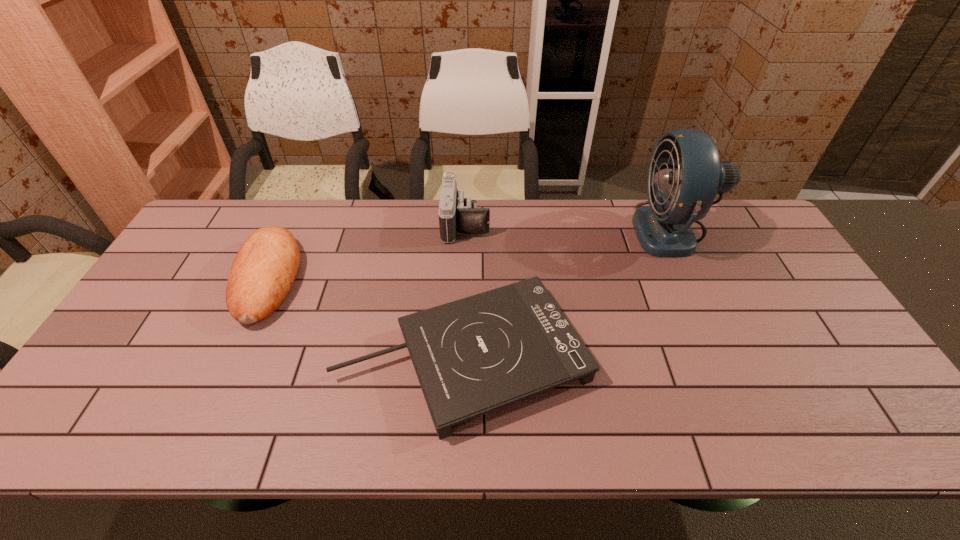
Where is `blank region between the third shortest object and the fan`? Image resolution: width=960 pixels, height=540 pixels. blank region between the third shortest object and the fan is located at coordinates (568, 227).

This screenshot has height=540, width=960. Find the location of `vacant space that's between the bread and the second tallest object`. vacant space that's between the bread and the second tallest object is located at coordinates (367, 252).

The height and width of the screenshot is (540, 960). I want to click on object that stands as the third closest to the fan, so click(x=264, y=269).

I want to click on object that ranks as the third closest to the bread, so click(x=678, y=196).

The image size is (960, 540). What are the coordinates of `vacant space that satisfies the following two spatial constraints: 1. at the front of the camera with an open lens cover; 2. on the left side of the shortest object` in the screenshot? It's located at (461, 356).

Identify the location of free region that satisfies the following two spatial constraints: 1. at the front of the camera with an open lens cover; 2. on the right side of the hotplate. The height and width of the screenshot is (540, 960). (461, 356).

The height and width of the screenshot is (540, 960). I want to click on blank space that satisfies the following two spatial constraints: 1. at the front of the second tallest object with an open lens cover; 2. on the back side of the hotplate, so click(x=461, y=356).

At what (x,y) coordinates should I click in order to perform the action: click on vacant region that satisfies the following two spatial constraints: 1. at the front of the hotplate with an open lens cover; 2. on the left side of the third shortest object. Please return your answer as a coordinate pair (x, y). The image size is (960, 540). Looking at the image, I should click on (461, 356).

Find the location of `vacant space that satisfies the following two spatial constraints: 1. at the front of the camera with an open lens cover; 2. on the back side of the shortest object`. vacant space that satisfies the following two spatial constraints: 1. at the front of the camera with an open lens cover; 2. on the back side of the shortest object is located at coordinates (461, 356).

Locate an element on the screen. vacant space that satisfies the following two spatial constraints: 1. on the back side of the hotplate; 2. at the front of the third shortest object with an open lens cover is located at coordinates (468, 224).